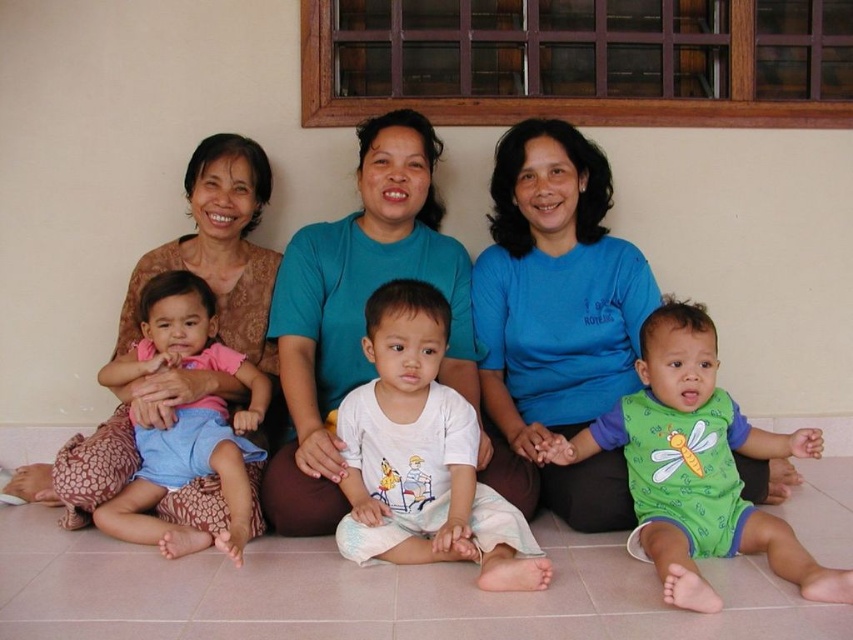
You are a photographer trying to capture a closeup of the green cotton onesie at lower right and the matte brown lace dress at left. Which one will appear larger in your photo?

The green cotton onesie at lower right is closer to the viewer than the matte brown lace dress at left, so it will appear larger in the photo.

Looking at the scene, where is the green cotton onesie at lower right in relation to the matte brown lace dress at left?

The green cotton onesie at lower right is to the right of the matte brown lace dress at left.